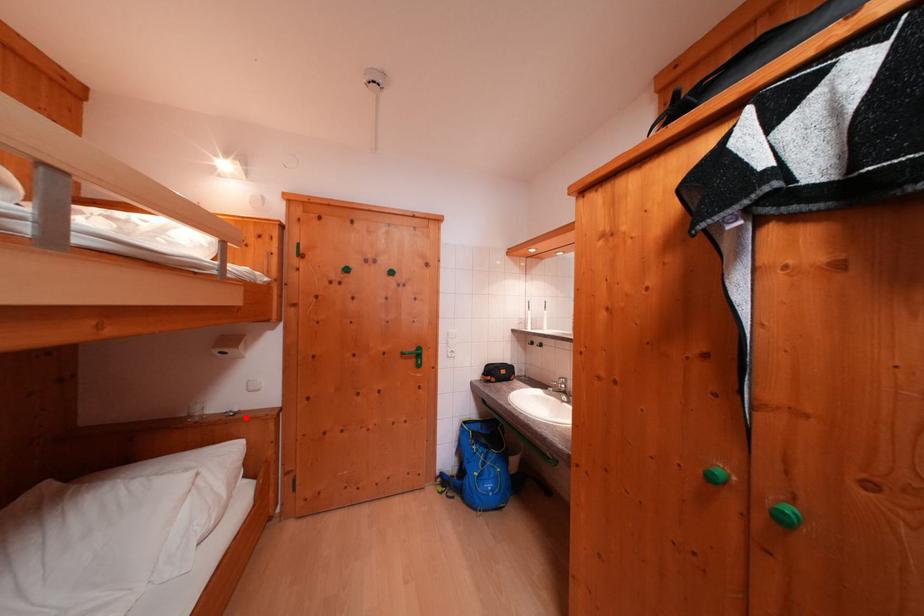
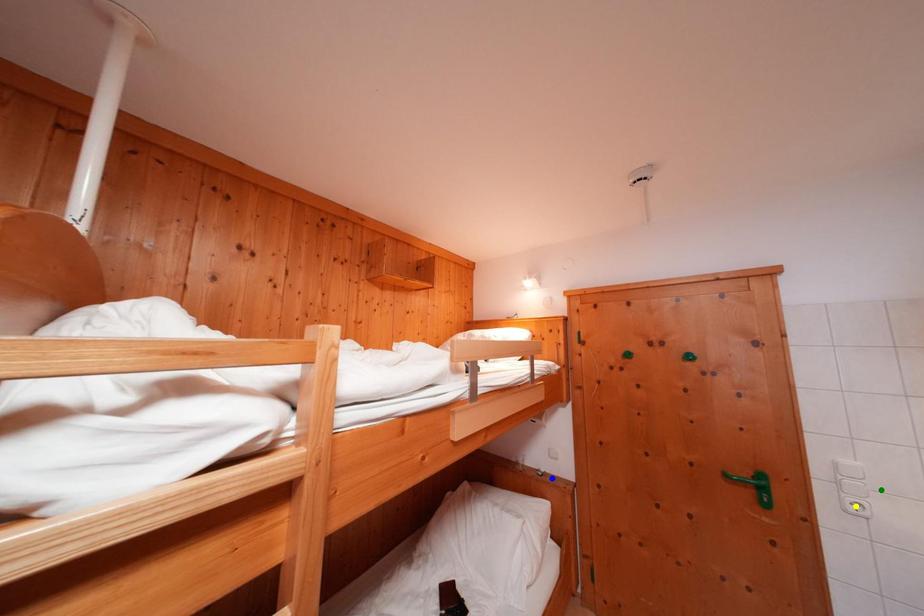
Question: I am providing you with two images of the same scene from different viewpoints. A red point is marked on the first image. You are given multiple points on the second image. Which spot in image 2 lines up with the point in image 1?

Choices:
 (A) blue point
 (B) green point
 (C) yellow point

Answer: (A)